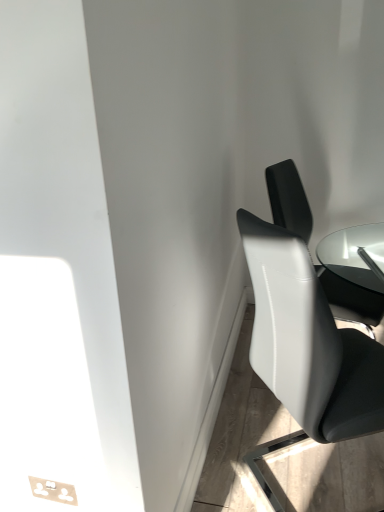
Question: Based on their sizes in the image, would you say white leather chair at right, placed as the second chair when sorted from front to back, is bigger or smaller than white glossy chair at right, which is the 2th chair in back-to-front order?

Choices:
 (A) small
 (B) big

Answer: (A)

Question: From a real-world perspective, relative to white glossy chair at right, which is the 2th chair in back-to-front order, is white leather chair at right, the 1th chair from the back, vertically above or below?

Choices:
 (A) above
 (B) below

Answer: (A)

Question: Would you say white leather chair at right, placed as the second chair when sorted from front to back, is to the left or to the right of white glossy chair at right, which is the 2th chair in back-to-front order, in the picture?

Choices:
 (A) right
 (B) left

Answer: (A)

Question: Relative to white leather chair at right, the 1th chair from the back, is white glossy chair at right, the first chair viewed from the front, in front or behind?

Choices:
 (A) front
 (B) behind

Answer: (A)

Question: From a real-world perspective, is white glossy chair at right, which is the 2th chair in back-to-front order, above or below white leather chair at right, placed as the second chair when sorted from front to back?

Choices:
 (A) below
 (B) above

Answer: (A)

Question: From the image's perspective, is white glossy chair at right, which is the 2th chair in back-to-front order, above or below white leather chair at right, the 1th chair from the back?

Choices:
 (A) above
 (B) below

Answer: (B)

Question: Considering the relative positions of white glossy chair at right, the first chair viewed from the front, and white leather chair at right, placed as the second chair when sorted from front to back, in the image provided, is white glossy chair at right, the first chair viewed from the front, to the left or to the right of white leather chair at right, placed as the second chair when sorted from front to back,?

Choices:
 (A) right
 (B) left

Answer: (B)